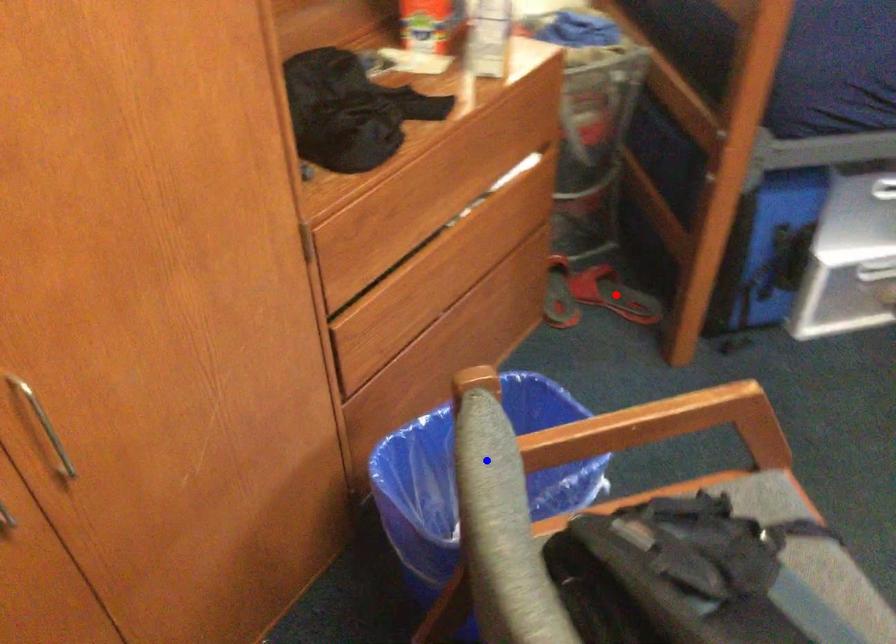
Question: Two points are marked on the image. Which point is closer to the camera?

Choices:
 (A) Blue point is closer.
 (B) Red point is closer.

Answer: (A)